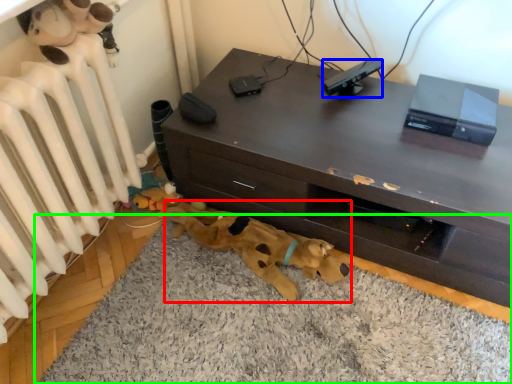
Question: Estimate the real-world distances between objects in this image. Which object is closer to toy (highlighted by a red box), equipment (highlighted by a blue box) or dog bed (highlighted by a green box)?

Choices:
 (A) equipment
 (B) dog bed

Answer: (B)